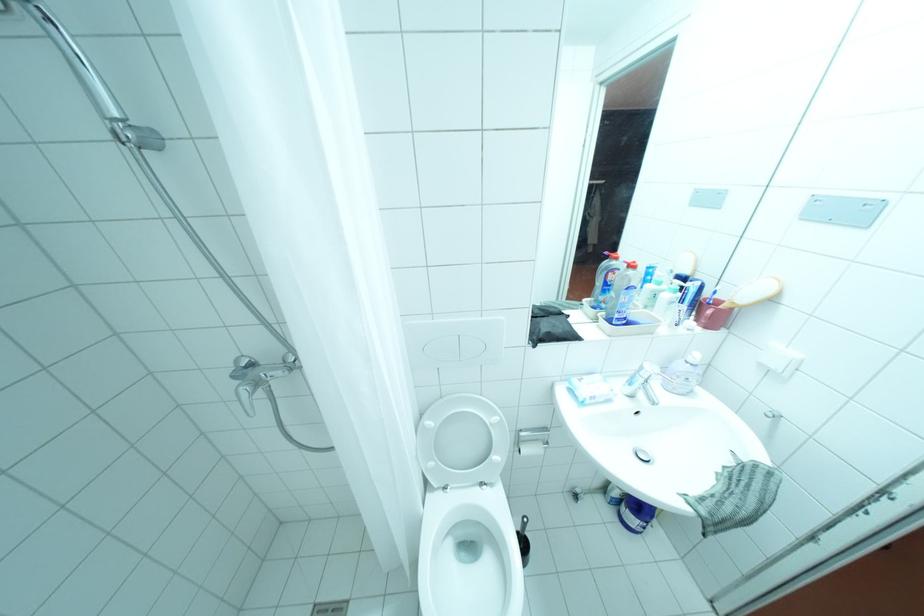
The height and width of the screenshot is (616, 924). I want to click on soap dispenser pump, so click(611, 249).